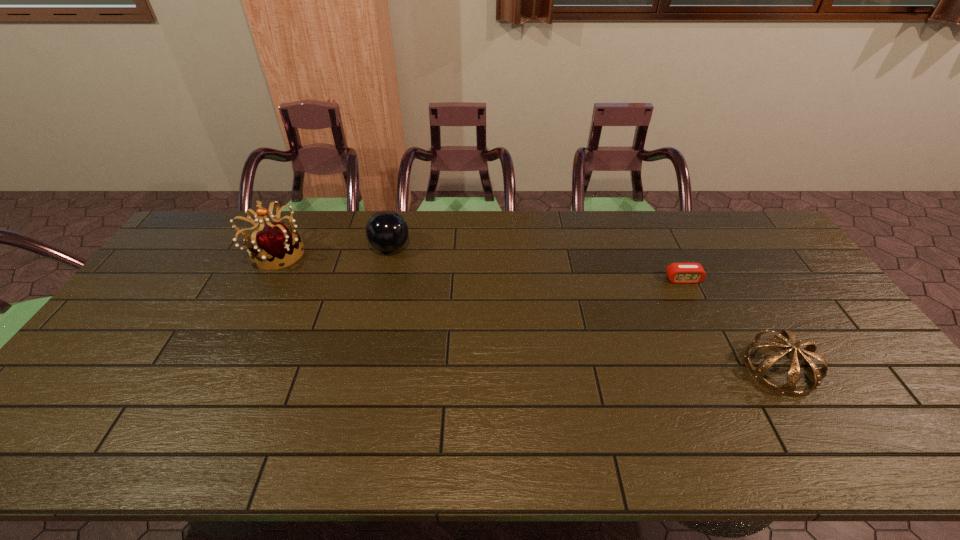
This screenshot has width=960, height=540. I want to click on vacant space situated 0.120m on the front-facing side of the shortest object, so click(699, 313).

You are a GUI agent. You are given a task and a screenshot of the screen. Output one action in this format:
    pyautogui.click(x=<x>, y=<y>)
    Task: Click on the tiara present at the far edge
    This screenshot has height=540, width=960.
    Given the screenshot: What is the action you would take?
    pyautogui.click(x=274, y=243)

Find the location of a particular element. bowling ball situated at the far edge is located at coordinates (387, 231).

Find the location of a particular element. The width and height of the screenshot is (960, 540). vacant region at the far edge is located at coordinates (497, 237).

Locate an element on the screen. free space at the left edge of the desktop is located at coordinates (205, 262).

You are a GUI agent. You are given a task and a screenshot of the screen. Output one action in this format:
    pyautogui.click(x=<x>, y=<y>)
    Task: Click on the vacant space at the right edge
    The image size is (960, 540).
    Given the screenshot: What is the action you would take?
    pyautogui.click(x=841, y=361)

Locate an element on the screen. blank space at the far left corner of the desktop is located at coordinates point(221,253).

This screenshot has width=960, height=540. In the image, there is a desktop. Find the location of `free region at the near right corner`. free region at the near right corner is located at coordinates (887, 432).

You are a GUI agent. You are given a task and a screenshot of the screen. Output one action in this format:
    pyautogui.click(x=<x>, y=<y>)
    Task: Click on the free spot between the second object from left to right and the farther tiara
    
    Given the screenshot: What is the action you would take?
    pyautogui.click(x=332, y=251)

The image size is (960, 540). I want to click on vacant space that is in between the alarm clock and the second tallest object, so click(537, 264).